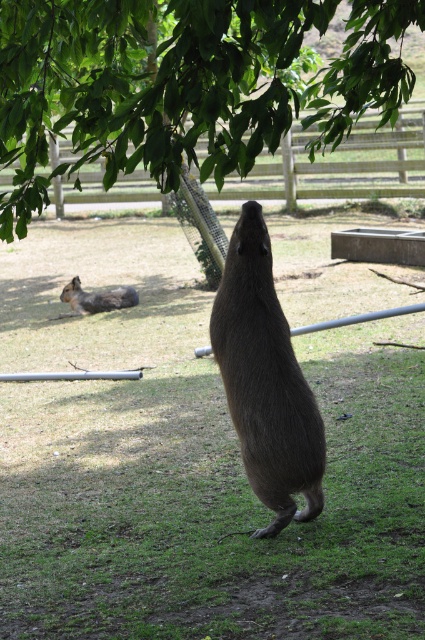
Which is below, brown furry capybara at center or brown furry rodent at lower left?

brown furry capybara at center

How far apart are brown furry capybara at center and brown furry rodent at lower left?

The distance of brown furry capybara at center from brown furry rodent at lower left is 5.85 meters.

Is point (272, 522) positioned in front of point (56, 317)?

Yes, point (272, 522) is in front of point (56, 317).

Where is `brown furry capybara at center`? The height and width of the screenshot is (640, 425). brown furry capybara at center is located at coordinates (266, 380).

Is brown furry capybara at center bigger than wooden fence at upper center?

Actually, brown furry capybara at center might be smaller than wooden fence at upper center.

Which is more to the left, brown furry capybara at center or wooden fence at upper center?

Positioned to the left is brown furry capybara at center.

Describe the element at coordinates (266, 380) in the screenshot. I see `brown furry capybara at center` at that location.

Locate an element on the screen. Image resolution: width=425 pixels, height=640 pixels. brown furry capybara at center is located at coordinates (266, 380).

Which is below, wooden fence at upper center or brown furry rodent at lower left?

brown furry rodent at lower left is below.

What do you see at coordinates (339, 164) in the screenshot? The image size is (425, 640). I see `wooden fence at upper center` at bounding box center [339, 164].

Does point (73, 192) lie behind point (76, 285)?

Yes, point (73, 192) is behind point (76, 285).

Find the location of a particular element. Image resolution: width=425 pixels, height=640 pixels. wooden fence at upper center is located at coordinates (339, 164).